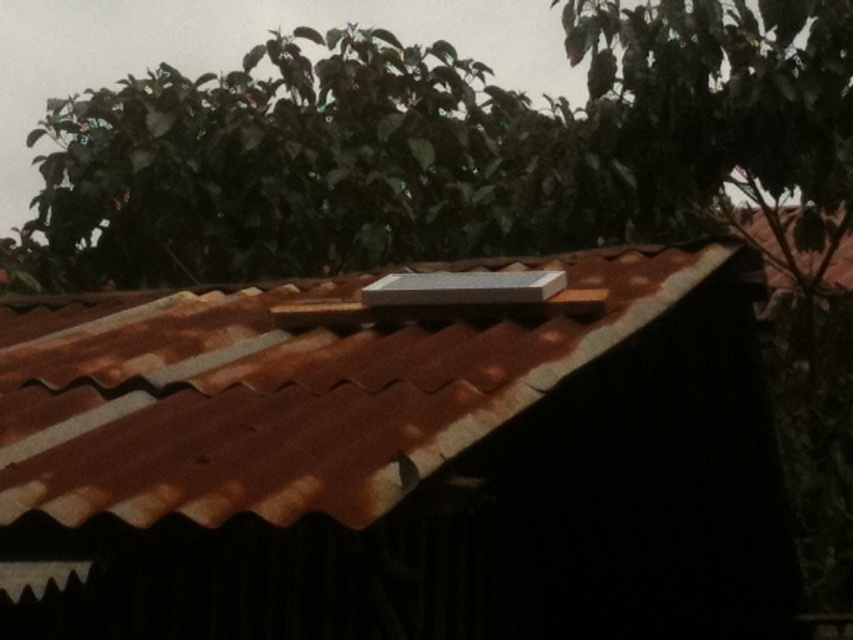
You are a drone operator trying to land a drone on the roof. The drone has a GPS coordinate system where the bottom left corner of the roof is at point 0,0 and the top right corner is at point 1,1. Where should you aim the drone to land on the rusty metal roof at center?

The rusty metal roof at center is located at point (397, 461) in the GPS coordinate system, so you should aim the drone at that coordinate to land on it.

You are standing on the ground looking at the roof and the tree. Which object is higher from the ground, the rusty metal roof at center or the green leafy tree at upper center?

The rusty metal roof at center is taller than the green leafy tree at upper center, so the rusty metal roof at center is higher from the ground.